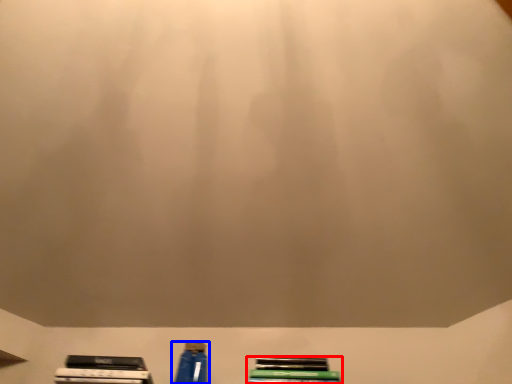
Question: Among these objects, which one is farthest to the camera, book (highlighted by a red box) or bottle (highlighted by a blue box)?

Choices:
 (A) book
 (B) bottle

Answer: (B)